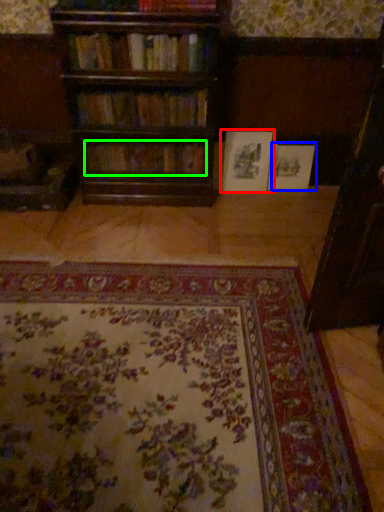
Question: Based on their relative distances, which object is nearer to book (highlighted by a red box)? Choose from book (highlighted by a blue box) and book (highlighted by a green box).

Choices:
 (A) book
 (B) book

Answer: (A)